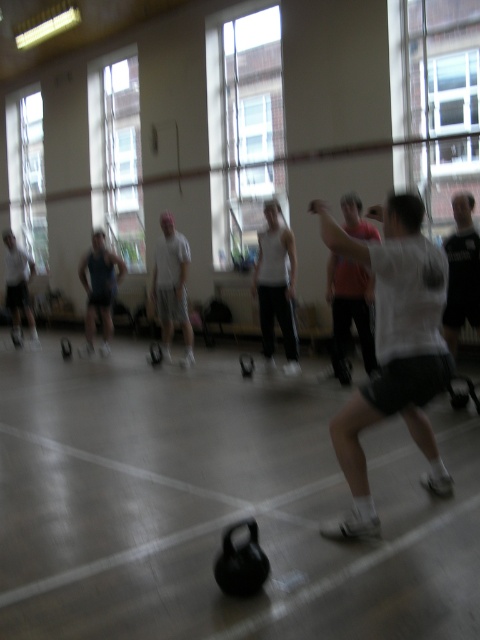
Find the location of a particular element. This screenshot has height=640, width=480. white matte shirt at center is located at coordinates (171, 285).

Measure the distance between white matte shirt at center and matte white tank top at left.

A distance of 4.68 meters exists between white matte shirt at center and matte white tank top at left.

Is point (155, 275) closer to viewer compared to point (22, 340)?

Yes, it is in front of point (22, 340).

At what (x,y) coordinates should I click in order to perform the action: click on white matte shirt at center. Please return your answer as a coordinate pair (x, y). This screenshot has height=640, width=480. Looking at the image, I should click on (171, 285).

Does pink fabric shirt at center have a lesser width compared to white matte shirt at center?

Correct, pink fabric shirt at center's width is less than white matte shirt at center's.

The height and width of the screenshot is (640, 480). Describe the element at coordinates (349, 312) in the screenshot. I see `pink fabric shirt at center` at that location.

Locate an element on the screen. This screenshot has height=640, width=480. pink fabric shirt at center is located at coordinates (349, 312).

Between point (386, 294) and point (115, 289), which one is positioned in front?

Point (386, 294) is more forward.

Who is more distant from viewer, (406,401) or (99,288)?

Point (99,288)

Image resolution: width=480 pixels, height=640 pixels. I want to click on white matte shorts at center, so click(394, 349).